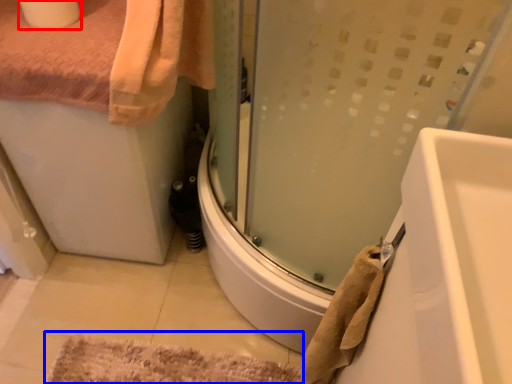
Question: Which object appears closest to the camera in this image, toilet paper (highlighted by a red box) or bath mat (highlighted by a blue box)?

Choices:
 (A) toilet paper
 (B) bath mat

Answer: (A)